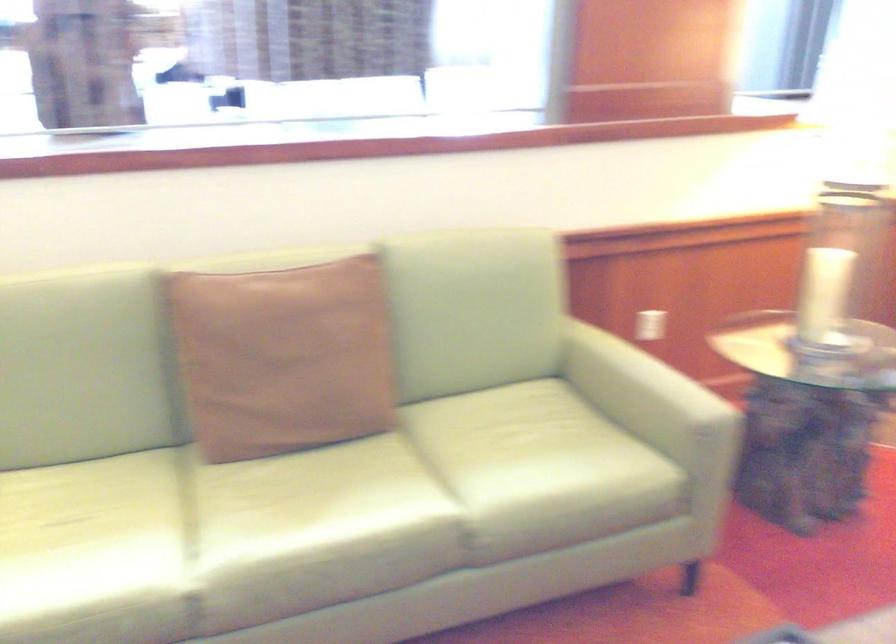
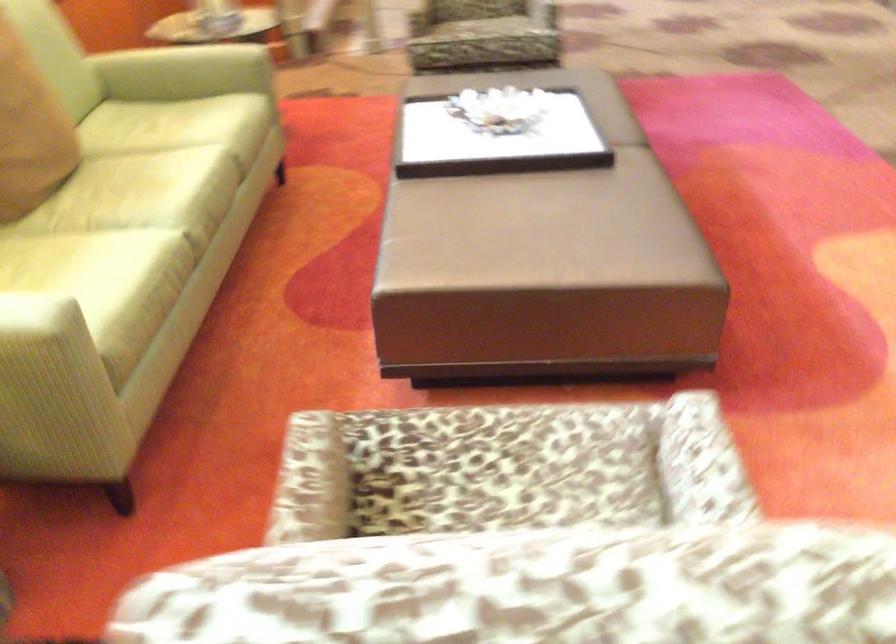
In the second image, find the point that corresponds to (x=260, y=516) in the first image.

(136, 199)